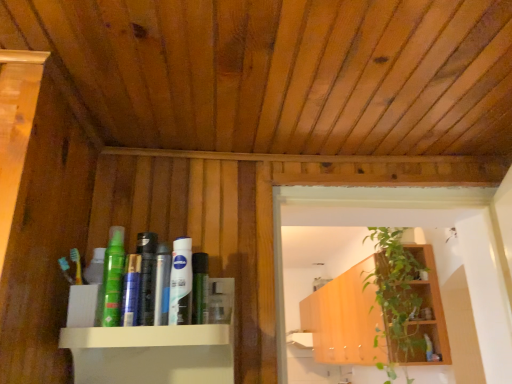
Question: Can you confirm if blue matte toothpaste at center is smaller than clear plastic bottle at center, the second toiletry in the right-to-left sequence?

Choices:
 (A) no
 (B) yes

Answer: (B)

Question: Is blue matte toothpaste at center placed right next to clear plastic bottle at center, the second toiletry in the right-to-left sequence?

Choices:
 (A) no
 (B) yes

Answer: (A)

Question: From a real-world perspective, is blue matte toothpaste at center positioned under clear plastic bottle at center, the second toiletry in the right-to-left sequence, based on gravity?

Choices:
 (A) no
 (B) yes

Answer: (B)

Question: Considering the relative sizes of blue matte toothpaste at center and clear plastic bottle at center, the sixth toiletry positioned from the left, in the image provided, is blue matte toothpaste at center taller than clear plastic bottle at center, the sixth toiletry positioned from the left,?

Choices:
 (A) yes
 (B) no

Answer: (A)

Question: Considering the relative sizes of blue matte toothpaste at center and clear plastic bottle at center, the sixth toiletry positioned from the left, in the image provided, is blue matte toothpaste at center shorter than clear plastic bottle at center, the sixth toiletry positioned from the left,?

Choices:
 (A) yes
 (B) no

Answer: (B)

Question: Is blue matte toothpaste at center surrounding clear plastic bottle at center, the sixth toiletry positioned from the left?

Choices:
 (A) yes
 (B) no

Answer: (B)

Question: From a real-world perspective, is silver metallic can at center, which appears as the third toiletry when viewed from the front, physically above matte black hair spray at upper center, acting as the 7th toiletry starting from the front?

Choices:
 (A) no
 (B) yes

Answer: (A)

Question: Considering the relative sizes of silver metallic can at center, which is the 3th toiletry from left to right, and matte black hair spray at upper center, the first toiletry positioned from the back, in the image provided, is silver metallic can at center, which is the 3th toiletry from left to right, shorter than matte black hair spray at upper center, the first toiletry positioned from the back,?

Choices:
 (A) no
 (B) yes

Answer: (A)

Question: Considering the relative sizes of silver metallic can at center, the fifth toiletry viewed from the right, and matte black hair spray at upper center, the first toiletry positioned from the back, in the image provided, is silver metallic can at center, the fifth toiletry viewed from the right, taller than matte black hair spray at upper center, the first toiletry positioned from the back,?

Choices:
 (A) yes
 (B) no

Answer: (A)

Question: Is matte black hair spray at upper center, acting as the 7th toiletry starting from the front, surrounded by silver metallic can at center, which appears as the third toiletry when viewed from the front?

Choices:
 (A) yes
 (B) no

Answer: (B)

Question: Can you confirm if silver metallic can at center, which is the 3th toiletry from left to right, is thinner than matte black hair spray at upper center, the 1th toiletry when ordered from right to left?

Choices:
 (A) no
 (B) yes

Answer: (B)

Question: Can you confirm if silver metallic can at center, which appears as the third toiletry when viewed from the front, is positioned to the right of matte black hair spray at upper center, the 1th toiletry when ordered from right to left?

Choices:
 (A) no
 (B) yes

Answer: (A)

Question: Could you tell me if blue matte toothpaste at center is turned towards silver metallic can at center, which appears as the third toiletry when viewed from the front?

Choices:
 (A) yes
 (B) no

Answer: (B)